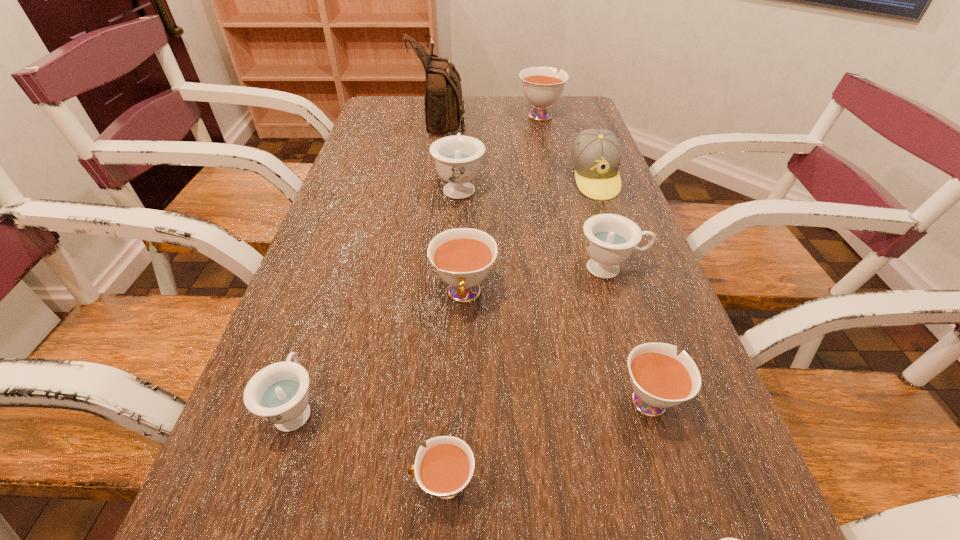
Locate an element on the screen. the third biggest blue teacup is located at coordinates (279, 394).

The image size is (960, 540). I want to click on the second nearest blue teacup, so click(x=279, y=394).

Find the location of a particular element. The width and height of the screenshot is (960, 540). the ninth farthest object is located at coordinates coord(446,466).

The image size is (960, 540). Find the location of `the smallest white teacup`. the smallest white teacup is located at coordinates (446, 466).

The image size is (960, 540). I want to click on vacant area situated 0.200m on the front-facing side of the shoulder bag, so [x=526, y=122].

At what (x,y) coordinates should I click in order to perform the action: click on free location located on the side of the farthest blue teacup with the handle. Please return your answer as a coordinate pair (x, y). This screenshot has height=540, width=960. Looking at the image, I should click on (464, 110).

Where is `free space located 0.080m on the side of the farthest blue teacup with the handle`? The width and height of the screenshot is (960, 540). free space located 0.080m on the side of the farthest blue teacup with the handle is located at coordinates (461, 155).

I want to click on vacant space located on the side of the farthest blue teacup with the handle, so click(x=462, y=140).

Locate an element on the screen. free point located 0.160m on the front-facing side of the yellow baseball cap is located at coordinates (615, 241).

Image resolution: width=960 pixels, height=540 pixels. I want to click on blank space located 0.260m on the side of the second farthest white teacup with the handle, so click(x=458, y=457).